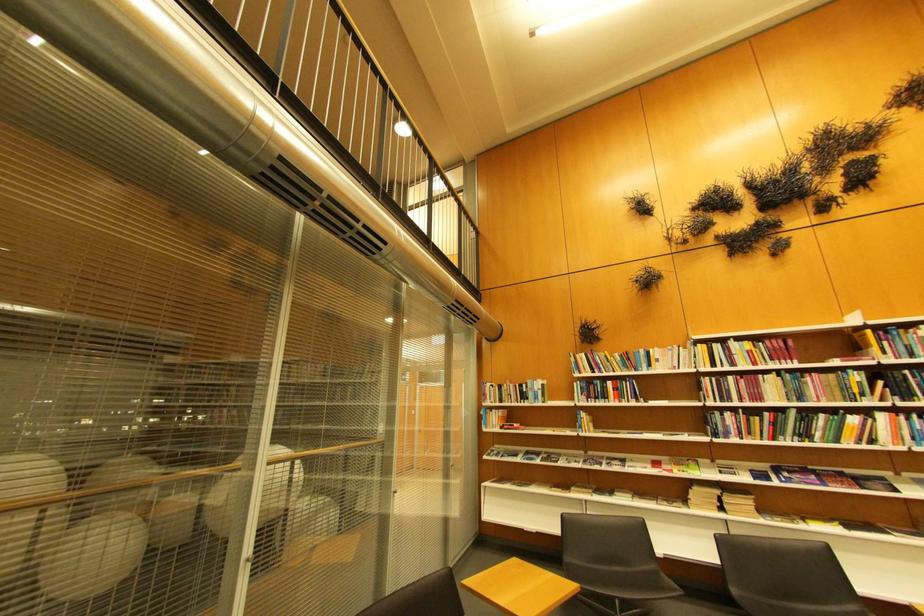
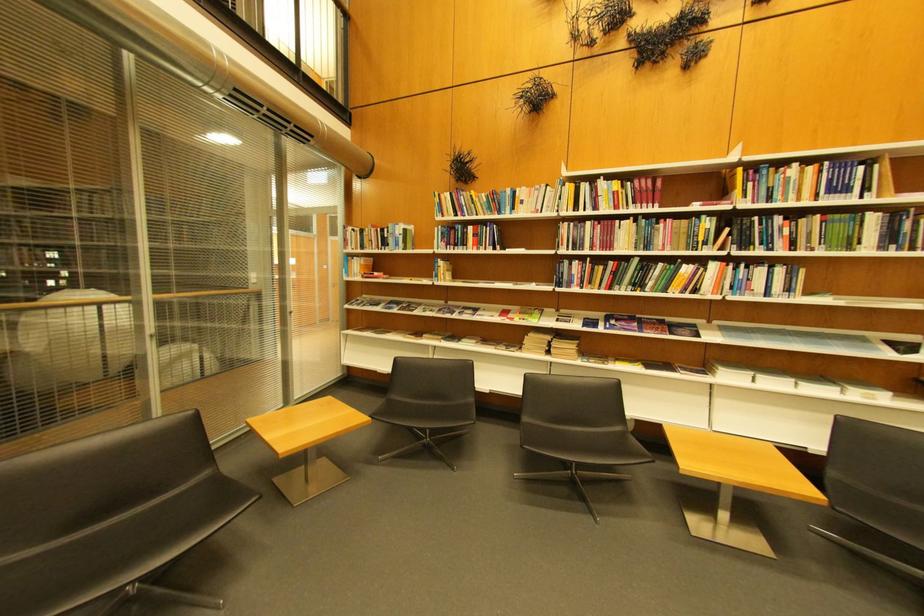
Locate, in the second image, the point that corresponds to pixel 740 379 in the first image.

(600, 225)